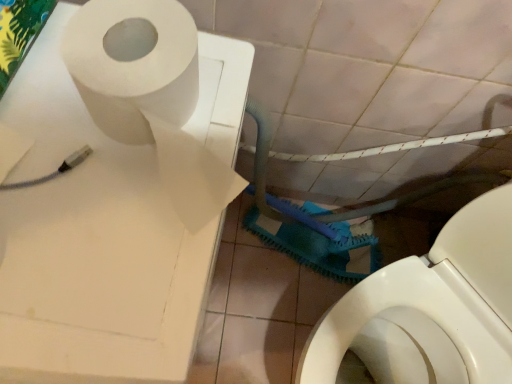
Locate an element on the screen. vacant area that is in front of white matte toilet paper at upper left is located at coordinates (101, 277).